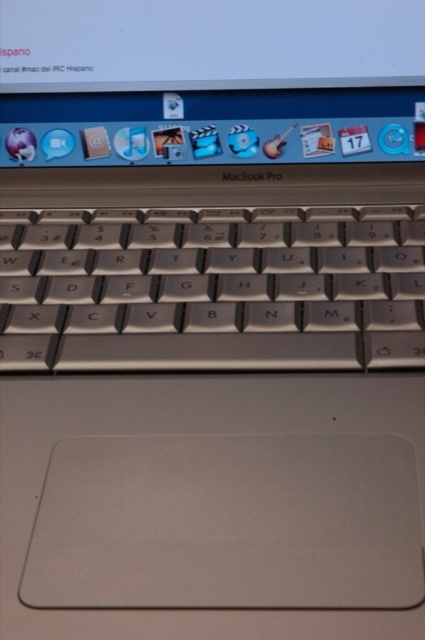
Is satin silver keyboard at center positioned behind white glossy screen at upper center?

No, satin silver keyboard at center is in front of white glossy screen at upper center.

Who is taller, satin silver keyboard at center or white glossy screen at upper center?

satin silver keyboard at center

Where is `satin silver keyboard at center`? satin silver keyboard at center is located at coordinates (214, 289).